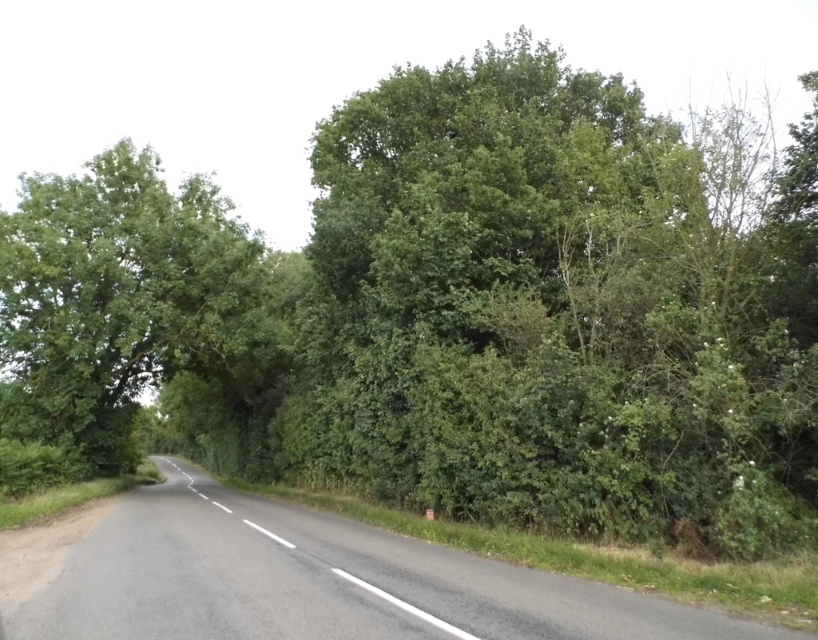
You are driving a car and see the black asphalt road at center and the green leafy tree at left. Which object is closer to the bottom of the image?

The black asphalt road at center is located below the green leafy tree at left, so it is closer to the bottom of the image.

You are driving a car with a width of 2 meters. The black asphalt road at center is the only path available. Can your car safely pass through the road without hitting the green leafy tree at left?

The black asphalt road at center has a smaller size compared to green leafy tree at left, but since the road is the only path available and it is two lanes wide, the car can safely pass through as long as it stays within the road markings and avoids the tree.

You are driving along the road and see the black asphalt road at center and the green leafy tree at left. Which object is positioned to the right of the other?

The black asphalt road at center is to the right of the green leafy tree at left.